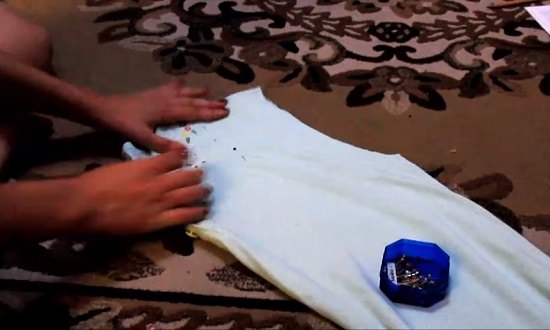
I want to click on brown and tan print rug, so click(x=404, y=75).